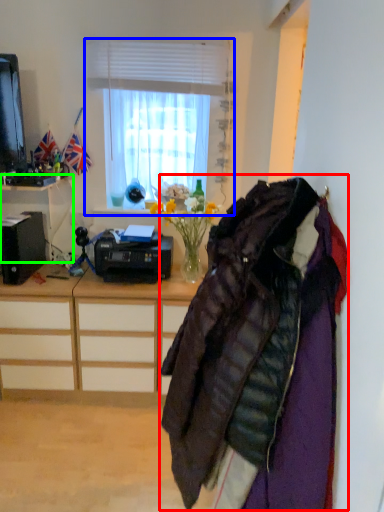
Question: Estimate the real-world distances between objects in this image. Which object is farther from jacket (highlighted by a red box), window (highlighted by a blue box) or desk (highlighted by a green box)?

Choices:
 (A) window
 (B) desk

Answer: (B)